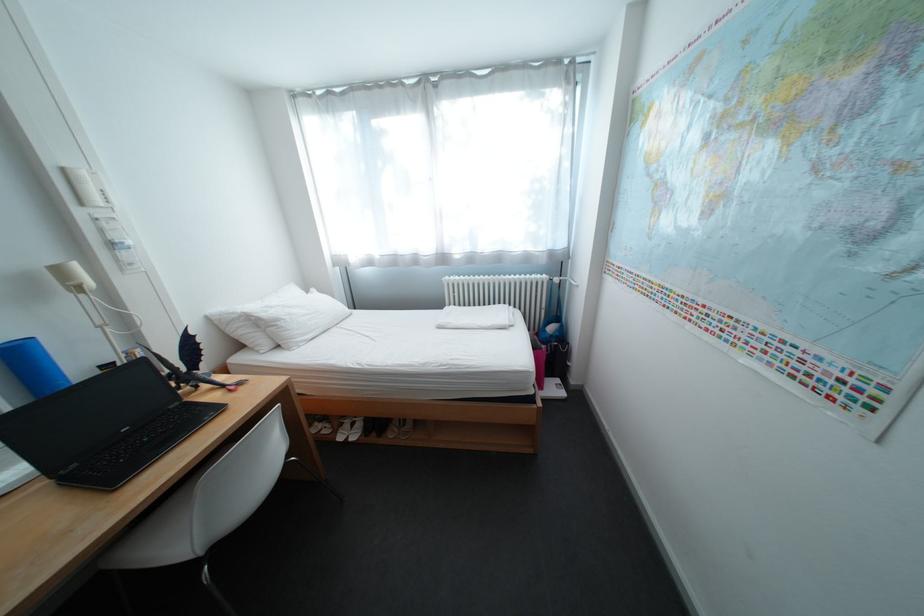
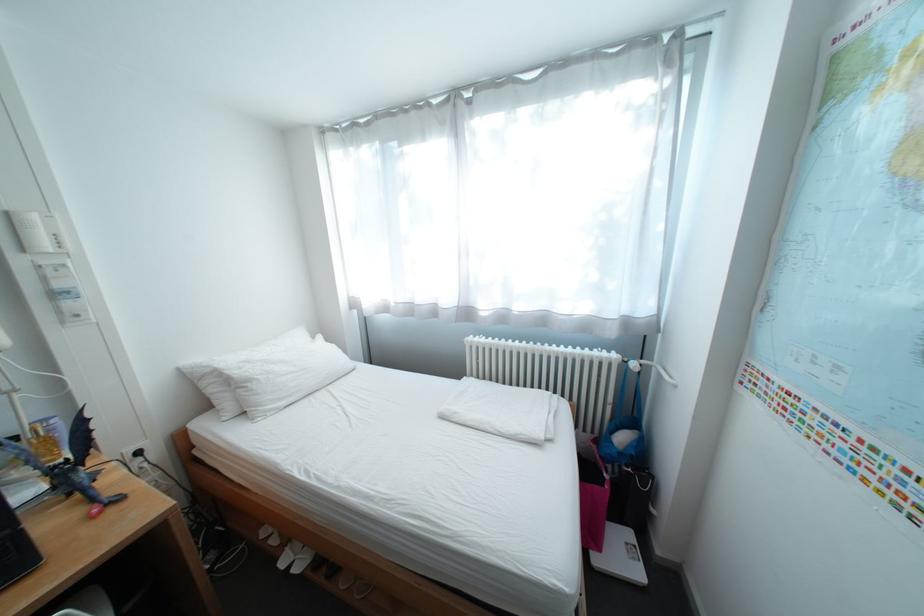
Where in the second image is the point corresponding to (566,387) from the first image?

(637, 548)